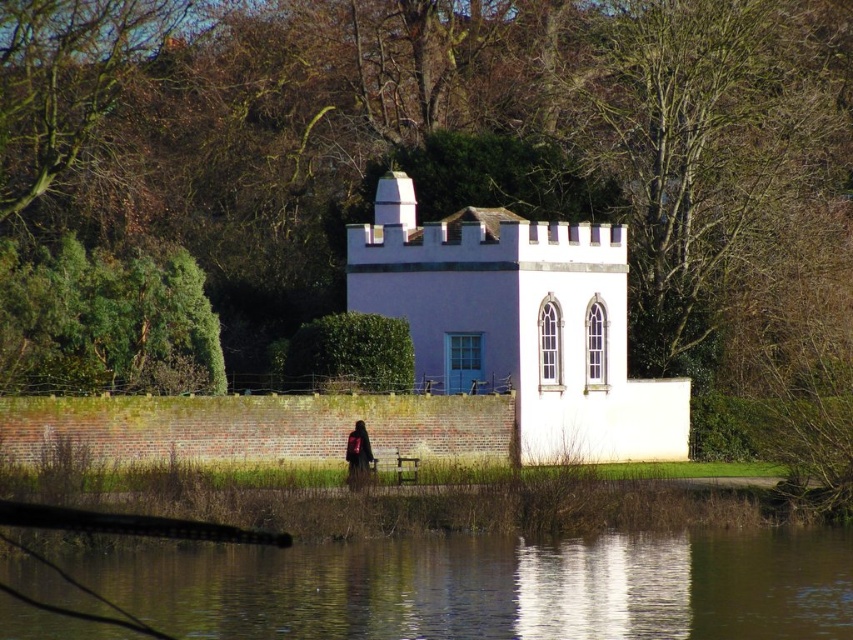
Question: Is white smooth chapel at center further to the viewer compared to dark brown leather backpack at center?

Choices:
 (A) yes
 (B) no

Answer: (A)

Question: Does transparent water at lower center appear on the right side of white smooth chapel at center?

Choices:
 (A) yes
 (B) no

Answer: (B)

Question: Which point is closer to the camera?

Choices:
 (A) white smooth chapel at center
 (B) transparent water at lower center

Answer: (B)

Question: Estimate the real-world distances between objects in this image. Which object is closer to the transparent water at lower center?

Choices:
 (A) dark brown leather backpack at center
 (B) white smooth chapel at center

Answer: (A)

Question: Does transparent water at lower center appear on the right side of white smooth chapel at center?

Choices:
 (A) no
 (B) yes

Answer: (A)

Question: Which object is positioned closest to the dark brown leather backpack at center?

Choices:
 (A) transparent water at lower center
 (B) white smooth chapel at center

Answer: (A)